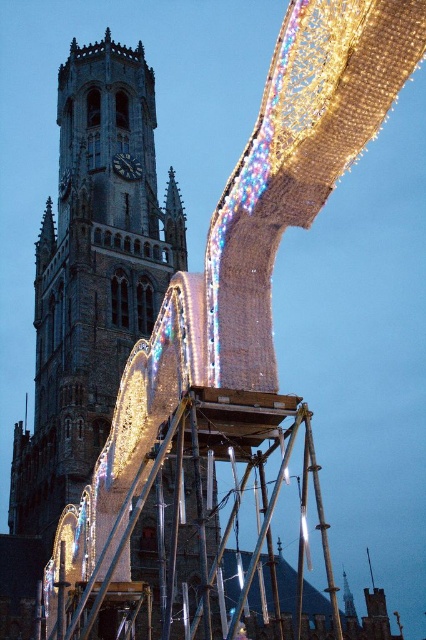
Is point (143, 262) positioned in front of point (138, 161)?

Yes, it is in front of point (138, 161).

In the scene shown: Which of these two, brick tower at center or dark gray wooden clock at center-left, stands taller?

With more height is brick tower at center.

Is point (160, 532) behind point (138, 163)?

No, (160, 532) is in front of (138, 163).

The width and height of the screenshot is (426, 640). Identify the location of brick tower at center. (114, 372).